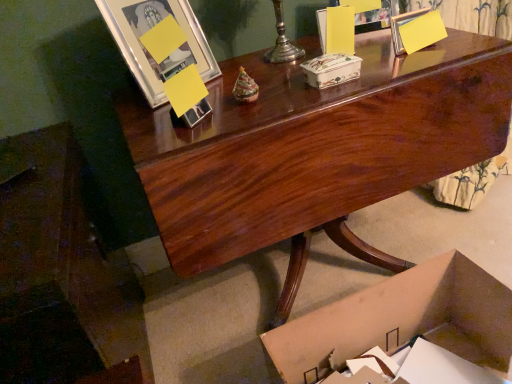
What is the approximate width of glossy wood desk at center?

It is 24.07 inches.

Find the location of a particular element. The image size is (512, 384). glossy wood desk at center is located at coordinates (315, 150).

How much space does matte silver picture frame at upper center, the second picture frame viewed from the front, occupy vertically?

The height of matte silver picture frame at upper center, the second picture frame viewed from the front, is 14.06 centimeters.

The height and width of the screenshot is (384, 512). What do you see at coordinates (148, 50) in the screenshot? I see `metallic silver picture frame at upper left, positioned as the first picture frame in front-to-back order` at bounding box center [148, 50].

In order to face metallic silver picture frame at upper left, the 1th picture frame when ordered from left to right, should I rotate leftwards or rightwards?

A 12.098 degree turn to the left will do.

The width and height of the screenshot is (512, 384). Describe the element at coordinates (331, 70) in the screenshot. I see `porcelain floral box at center, which ranks as the 1th box in top-to-bottom order` at that location.

The width and height of the screenshot is (512, 384). In order to click on glossy wood desk at center in this screenshot , I will do `click(315, 150)`.

Identify the location of the 2nd picture frame behind the glossy wood desk at center, starting your count from the anchor. (373, 18).

Can you see glossy wood desk at center touching matte silver picture frame at upper center, the second picture frame viewed from the front?

No, glossy wood desk at center is not touching matte silver picture frame at upper center, the second picture frame viewed from the front.

Considering the positions of point (355, 100) and point (376, 30), is point (355, 100) closer or farther from the camera than point (376, 30)?

Clearly, point (355, 100) is closer to the camera than point (376, 30).

Looking at their sizes, would you say glossy wood desk at center is wider or thinner than matte silver picture frame at upper center, the second picture frame viewed from the front?

glossy wood desk at center is wider than matte silver picture frame at upper center, the second picture frame viewed from the front.

Which object is closer to the camera taking this photo, metallic silver picture frame at upper left, marked as the second picture frame in a right-to-left arrangement, or glossy wood desk at center?

glossy wood desk at center.

Considering the relative sizes of metallic silver picture frame at upper left, marked as the second picture frame in a right-to-left arrangement, and glossy wood desk at center in the image provided, is metallic silver picture frame at upper left, marked as the second picture frame in a right-to-left arrangement, bigger than glossy wood desk at center?

No, metallic silver picture frame at upper left, marked as the second picture frame in a right-to-left arrangement, is not bigger than glossy wood desk at center.

Can you tell me how much metallic silver picture frame at upper left, marked as the 2th picture frame in a back-to-front arrangement, and glossy wood desk at center differ in facing direction?

28.2 degrees separate the facing orientations of metallic silver picture frame at upper left, marked as the 2th picture frame in a back-to-front arrangement, and glossy wood desk at center.

Does metallic silver picture frame at upper left, positioned as the first picture frame in front-to-back order, turn towards cardboard box at lower right, placed as the 2th box when sorted from top to bottom?

No, metallic silver picture frame at upper left, positioned as the first picture frame in front-to-back order, is not aimed at cardboard box at lower right, placed as the 2th box when sorted from top to bottom.

Between metallic silver picture frame at upper left, the 1th picture frame when ordered from left to right, and cardboard box at lower right, placed as the 2th box when sorted from top to bottom, which one appears on the right side from the viewer's perspective?

cardboard box at lower right, placed as the 2th box when sorted from top to bottom, is more to the right.

Is metallic silver picture frame at upper left, marked as the 2th picture frame in a back-to-front arrangement, closer to the viewer compared to cardboard box at lower right, the first box when ordered from bottom to top?

No, it is not.

Is matte silver picture frame at upper center, which is the first picture frame from right to left, positioned with its back to metallic silver picture frame at upper left, marked as the 2th picture frame in a back-to-front arrangement?

matte silver picture frame at upper center, which is the first picture frame from right to left, does not have its back to metallic silver picture frame at upper left, marked as the 2th picture frame in a back-to-front arrangement.

Looking at this image, is metallic silver picture frame at upper left, marked as the 2th picture frame in a back-to-front arrangement, surrounded by matte silver picture frame at upper center, positioned as the 2th picture frame in left-to-right order?

No, matte silver picture frame at upper center, positioned as the 2th picture frame in left-to-right order, does not contain metallic silver picture frame at upper left, marked as the 2th picture frame in a back-to-front arrangement.

Can you confirm if matte silver picture frame at upper center, positioned as the 2th picture frame in left-to-right order, is thinner than metallic silver picture frame at upper left, positioned as the first picture frame in front-to-back order?

Correct, the width of matte silver picture frame at upper center, positioned as the 2th picture frame in left-to-right order, is less than that of metallic silver picture frame at upper left, positioned as the first picture frame in front-to-back order.

Does matte silver picture frame at upper center, positioned as the 2th picture frame in left-to-right order, have a smaller size compared to metallic silver picture frame at upper left, positioned as the first picture frame in front-to-back order?

Yes.

Is matte silver picture frame at upper center, positioned as the 2th picture frame in left-to-right order, to the right of glossy wood desk at center from the viewer's perspective?

Indeed, matte silver picture frame at upper center, positioned as the 2th picture frame in left-to-right order, is positioned on the right side of glossy wood desk at center.

Can you confirm if matte silver picture frame at upper center, which is the first picture frame from right to left, is wider than glossy wood desk at center?

No, matte silver picture frame at upper center, which is the first picture frame from right to left, is not wider than glossy wood desk at center.

Choose the correct answer: Is matte silver picture frame at upper center, the second picture frame viewed from the front, inside glossy wood desk at center or outside it?

matte silver picture frame at upper center, the second picture frame viewed from the front, exists outside the volume of glossy wood desk at center.

Is the surface of matte silver picture frame at upper center, which is the first picture frame from right to left, in direct contact with glossy wood desk at center?

matte silver picture frame at upper center, which is the first picture frame from right to left, is not next to glossy wood desk at center, and they're not touching.

Which point is more distant from viewer, (146, 69) or (364, 18)?

Positioned behind is point (364, 18).

Between metallic silver picture frame at upper left, marked as the 2th picture frame in a back-to-front arrangement, and matte silver picture frame at upper center, the second picture frame viewed from the front, which one has less height?

With less height is matte silver picture frame at upper center, the second picture frame viewed from the front.

Could you measure the distance between metallic silver picture frame at upper left, marked as the 2th picture frame in a back-to-front arrangement, and matte silver picture frame at upper center, the second picture frame viewed from the front?

The distance of metallic silver picture frame at upper left, marked as the 2th picture frame in a back-to-front arrangement, from matte silver picture frame at upper center, the second picture frame viewed from the front, is 19.29 inches.

Is the surface of metallic silver picture frame at upper left, marked as the second picture frame in a right-to-left arrangement, in direct contact with matte silver picture frame at upper center, positioned as the 2th picture frame in left-to-right order?

There is a gap between metallic silver picture frame at upper left, marked as the second picture frame in a right-to-left arrangement, and matte silver picture frame at upper center, positioned as the 2th picture frame in left-to-right order.

Is glossy wood desk at center far from cardboard box at lower right, the first box when ordered from bottom to top?

No, glossy wood desk at center is in close proximity to cardboard box at lower right, the first box when ordered from bottom to top.

From a real-world perspective, is glossy wood desk at center positioned above or below cardboard box at lower right, the first box when ordered from bottom to top?

Clearly, from a real-world perspective, glossy wood desk at center is above cardboard box at lower right, the first box when ordered from bottom to top.

From the image's perspective, would you say glossy wood desk at center is shown under cardboard box at lower right, the first box when ordered from bottom to top?

Incorrect, from the image's perspective, glossy wood desk at center is higher than cardboard box at lower right, the first box when ordered from bottom to top.

From the image's perspective, which picture frame is the 2nd one above the glossy wood desk at center? Please provide its 2D coordinates.

[(373, 18)]

From a real-world perspective, starting from the glossy wood desk at center, which picture frame is the 2nd one vertically above it? Please provide its 2D coordinates.

[(148, 50)]

Based on their spatial positions, is glossy wood desk at center or porcelain floral box at center, the second box when ordered from bottom to top, further from cardboard box at lower right, placed as the 2th box when sorted from top to bottom?

Based on the image, porcelain floral box at center, the second box when ordered from bottom to top, appears to be further to cardboard box at lower right, placed as the 2th box when sorted from top to bottom.

Based on their spatial positions, is glossy wood desk at center or cardboard box at lower right, the first box when ordered from bottom to top, closer to matte silver picture frame at upper center, which is the first picture frame from right to left?

glossy wood desk at center is closer to matte silver picture frame at upper center, which is the first picture frame from right to left.

Estimate the real-world distances between objects in this image. Which object is further from metallic silver picture frame at upper left, marked as the second picture frame in a right-to-left arrangement, cardboard box at lower right, placed as the 2th box when sorted from top to bottom, or matte silver picture frame at upper center, the 1th picture frame when ordered from back to front?

Based on the image, cardboard box at lower right, placed as the 2th box when sorted from top to bottom, appears to be further to metallic silver picture frame at upper left, marked as the second picture frame in a right-to-left arrangement.

Based on their spatial positions, is metallic silver picture frame at upper left, marked as the second picture frame in a right-to-left arrangement, or porcelain floral box at center, the second box when ordered from bottom to top, closer to matte silver picture frame at upper center, the 1th picture frame when ordered from back to front?

Among the two, porcelain floral box at center, the second box when ordered from bottom to top, is located nearer to matte silver picture frame at upper center, the 1th picture frame when ordered from back to front.

Which object lies further to the anchor point glossy wood desk at center, cardboard box at lower right, placed as the 2th box when sorted from top to bottom, or metallic silver picture frame at upper left, marked as the 2th picture frame in a back-to-front arrangement?

cardboard box at lower right, placed as the 2th box when sorted from top to bottom, is positioned further to the anchor glossy wood desk at center.

Looking at the image, which one is located closer to cardboard box at lower right, the first box when ordered from bottom to top, glossy wood desk at center or matte silver picture frame at upper center, positioned as the 2th picture frame in left-to-right order?

glossy wood desk at center.

Which object lies nearer to the anchor point porcelain floral box at center, which ranks as the 1th box in top-to-bottom order, glossy wood desk at center or matte silver picture frame at upper center, positioned as the 2th picture frame in left-to-right order?

glossy wood desk at center is closer to porcelain floral box at center, which ranks as the 1th box in top-to-bottom order.

Consider the image. Which object lies further to the anchor point glossy wood desk at center, cardboard box at lower right, placed as the 2th box when sorted from top to bottom, or porcelain floral box at center, the second box when ordered from bottom to top?

cardboard box at lower right, placed as the 2th box when sorted from top to bottom, is further to glossy wood desk at center.

Locate an element on the screen. The height and width of the screenshot is (384, 512). box between metallic silver picture frame at upper left, marked as the 2th picture frame in a back-to-front arrangement, and cardboard box at lower right, the first box when ordered from bottom to top, in the up-down direction is located at coordinates (331, 70).

Where is `desk between metallic silver picture frame at upper left, positioned as the first picture frame in front-to-back order, and matte silver picture frame at upper center, the 1th picture frame when ordered from back to front, in the horizontal direction`? This screenshot has height=384, width=512. desk between metallic silver picture frame at upper left, positioned as the first picture frame in front-to-back order, and matte silver picture frame at upper center, the 1th picture frame when ordered from back to front, in the horizontal direction is located at coordinates (315, 150).

Locate an element on the screen. desk that lies between matte silver picture frame at upper center, positioned as the 2th picture frame in left-to-right order, and cardboard box at lower right, the first box when ordered from bottom to top, from top to bottom is located at coordinates 315,150.

Image resolution: width=512 pixels, height=384 pixels. Identify the location of box between matte silver picture frame at upper center, the 1th picture frame when ordered from back to front, and glossy wood desk at center from top to bottom. (331, 70).